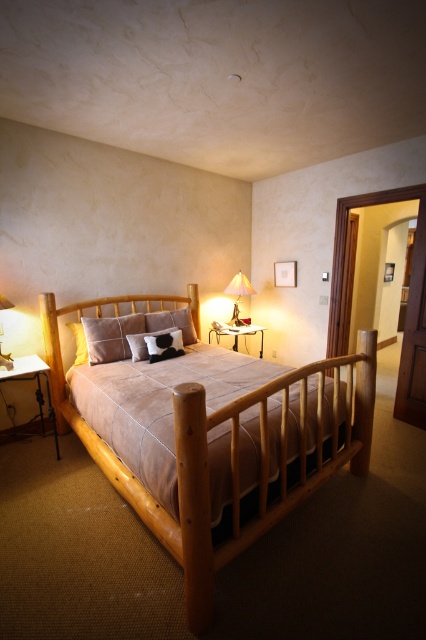
Who is positioned more to the left, velvet brown pillow at center or matte gold lamp at upper right?

From the viewer's perspective, velvet brown pillow at center appears more on the left side.

Between velvet brown pillow at center and matte gold lamp at upper right, which one is positioned higher?

matte gold lamp at upper right

This screenshot has width=426, height=640. Describe the element at coordinates (111, 337) in the screenshot. I see `velvet brown pillow at center` at that location.

Locate an element on the screen. velvet brown pillow at center is located at coordinates (111, 337).

Which is in front, point (77, 305) or point (180, 332)?

Positioned in front is point (77, 305).

Between point (198, 296) and point (160, 349), which one is positioned in front?

Point (160, 349) is in front.

Where is `brown wooden headboard at center`? Image resolution: width=426 pixels, height=640 pixels. brown wooden headboard at center is located at coordinates (100, 316).

Consider the image. Is brown leather bed at center closer to the viewer compared to matte gold lamp at upper right?

Yes, it is in front of matte gold lamp at upper right.

Does brown leather bed at center have a lesser width compared to matte gold lamp at upper right?

Incorrect, brown leather bed at center's width is not less than matte gold lamp at upper right's.

Does point (155, 301) lie in front of point (253, 288)?

Yes, it is in front of point (253, 288).

This screenshot has height=640, width=426. I want to click on brown leather bed at center, so click(x=210, y=435).